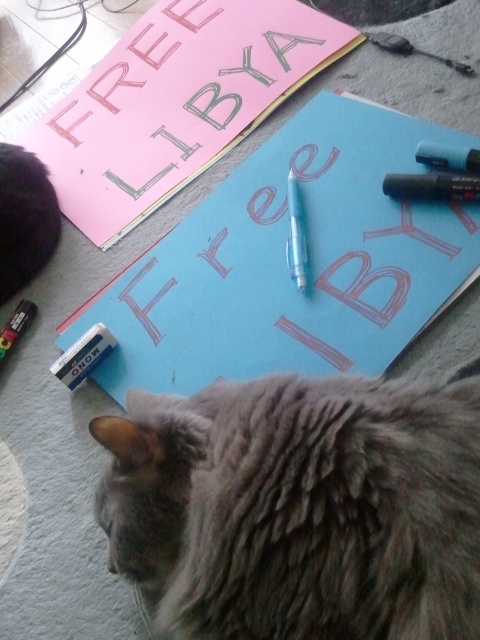
Question: Based on their relative distances, which object is nearer to the gray fluffy cat at upper left?

Choices:
 (A) translucent plastic pencil at center
 (B) gray fluffy cat at lower center

Answer: (A)

Question: Which of the following is the closest to the observer?

Choices:
 (A) gray fluffy cat at lower center
 (B) translucent plastic pencil at center
 (C) gray fluffy cat at upper left

Answer: (A)

Question: Does gray fluffy cat at lower center have a lesser width compared to gray fluffy cat at upper left?

Choices:
 (A) yes
 (B) no

Answer: (B)

Question: Estimate the real-world distances between objects in this image. Which object is farther from the gray fluffy cat at lower center?

Choices:
 (A) translucent plastic pencil at center
 (B) gray fluffy cat at upper left

Answer: (B)

Question: Does gray fluffy cat at lower center appear on the left side of translucent plastic pencil at center?

Choices:
 (A) yes
 (B) no

Answer: (A)

Question: Is gray fluffy cat at lower center behind translucent plastic pencil at center?

Choices:
 (A) yes
 (B) no

Answer: (B)